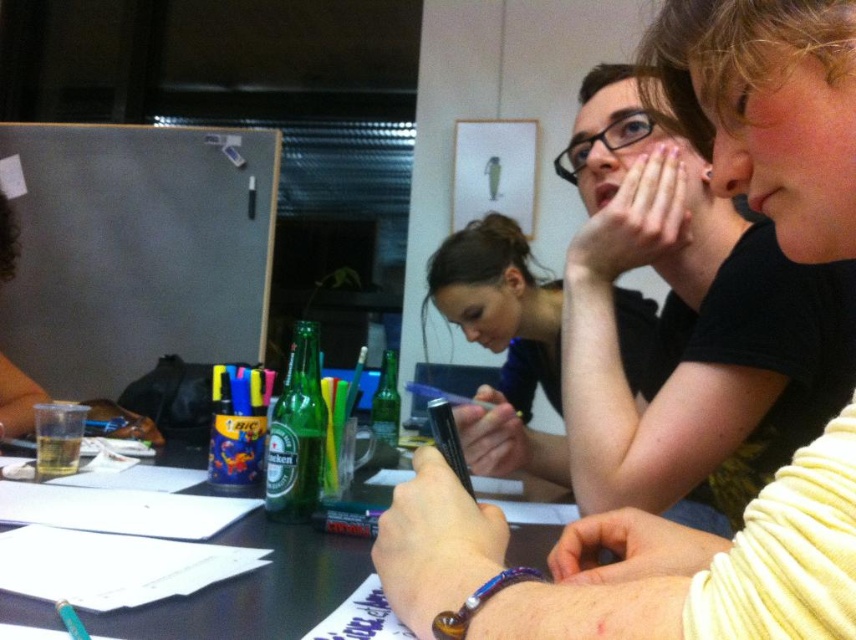
You are organizing a meeting and need to choose between the matte black pen at center and the translucent plastic table at center for a presentation. Which item is bigger?

The matte black pen at center is larger than the translucent plastic table at center.

Based on the scene described, can you determine which object is taller between the matte black pen at center and the translucent plastic table at center?

The matte black pen at center is taller than the translucent plastic table at center according to the description.

You are a person who wants to place a 20 inch long object on the table. You are standing next to the smooth black shirt at center. Can you place the object on the translucent plastic table at center without moving the shirt?

The distance between the smooth black shirt at center and the translucent plastic table at center is 19.94 inches, which is slightly less than the object length. Therefore, you cannot place the object on the table without moving the shirt.